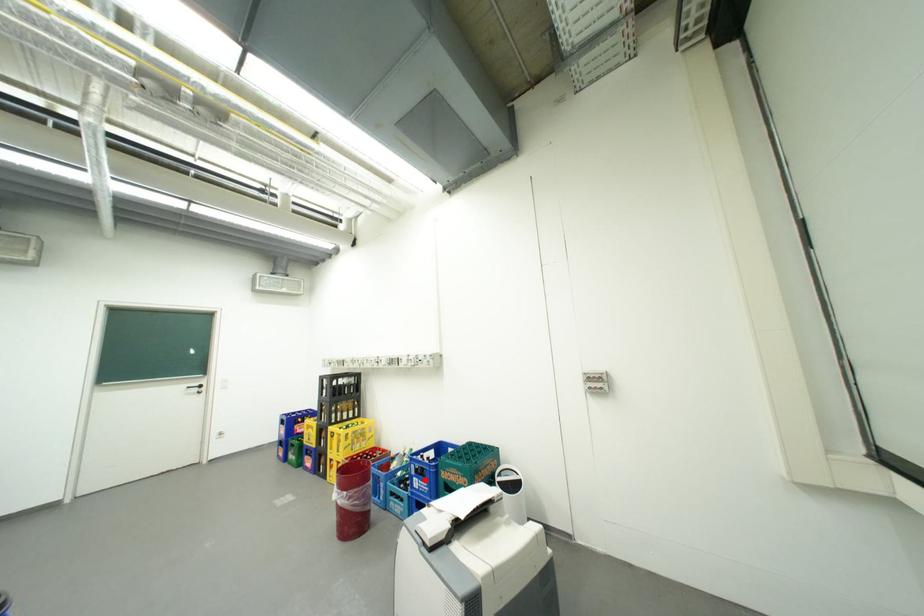
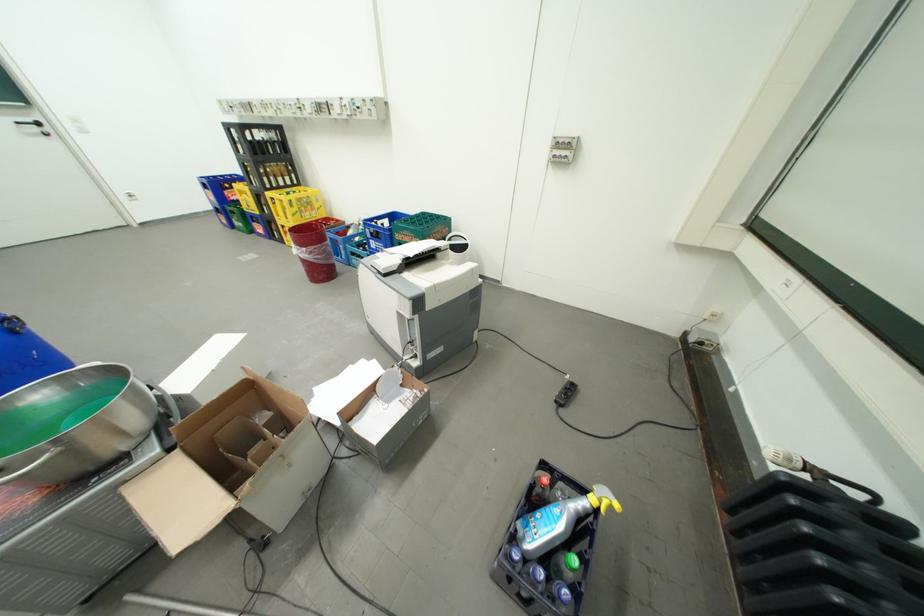
Question: I am providing you with two images of the same scene from different viewpoints. Image1 has a red point marked. In image2, the corresponding 3D location appears at what relative position? Reply with the corresponding letter.

Choices:
 (A) Closer
 (B) Farther

Answer: (B)